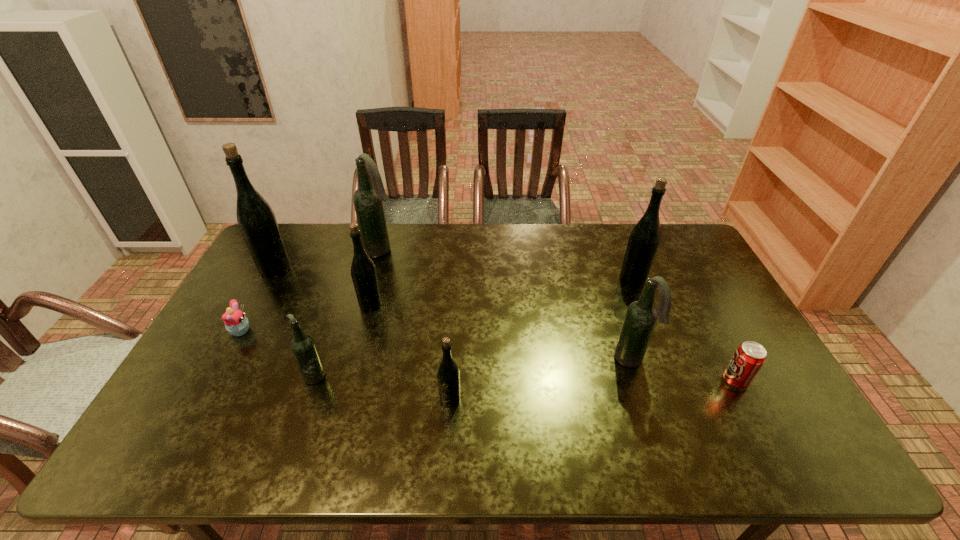
This screenshot has width=960, height=540. I want to click on the sixth object from left to right, so click(x=448, y=376).

Identify the location of the fifth beer bottle from left to right. (448, 376).

Where is `the rightmost object`? The width and height of the screenshot is (960, 540). the rightmost object is located at coordinates (748, 359).

Where is `soda`? soda is located at coordinates (748, 359).

The width and height of the screenshot is (960, 540). In order to click on the fifth farthest object in this screenshot , I will do `click(236, 323)`.

Locate an element on the screen. Image resolution: width=960 pixels, height=540 pixels. cupcake is located at coordinates (236, 323).

This screenshot has height=540, width=960. Find the location of `free space located 0.210m on the front of the biggest green beer bottle`. free space located 0.210m on the front of the biggest green beer bottle is located at coordinates (244, 326).

This screenshot has height=540, width=960. Identify the location of vacant space situated on the right of the rightmost green beer bottle. (680, 280).

I want to click on vacant point located on the right of the farthest dark beer bottle, so click(488, 251).

Locate an element on the screen. free space located on the back of the third farthest green beer bottle is located at coordinates pyautogui.click(x=387, y=242).